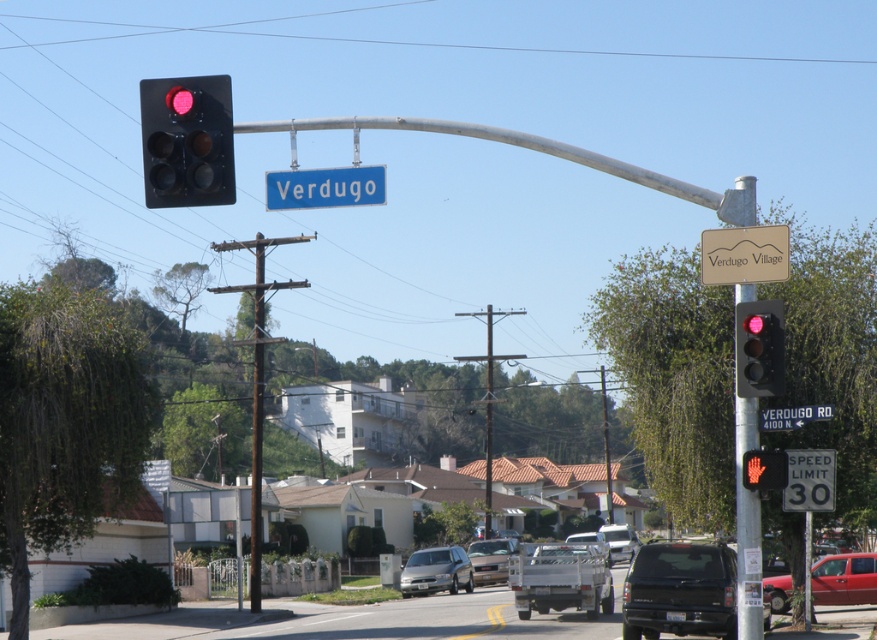
Question: Among these objects, which one is farthest from the camera?

Choices:
 (A) matte black traffic light at right
 (B) wooden sign at upper right

Answer: (B)

Question: Which of these objects is positioned farthest from the metallic red sedan at lower right?

Choices:
 (A) wooden sign at upper right
 (B) matte black suv at center

Answer: (A)

Question: Is wooden sign at upper right thinner than matte black traffic light at right?

Choices:
 (A) yes
 (B) no

Answer: (B)

Question: Is wooden sign at upper right bigger than white plastic speed limit sign at right?

Choices:
 (A) no
 (B) yes

Answer: (A)

Question: From the image, what is the correct spatial relationship of wooden sign at upper right in relation to metallic streetlight at center?

Choices:
 (A) right
 (B) left

Answer: (A)

Question: Which of the following is the farthest from the observer?

Choices:
 (A) matte black traffic light at right
 (B) white plastic street sign at upper center

Answer: (B)